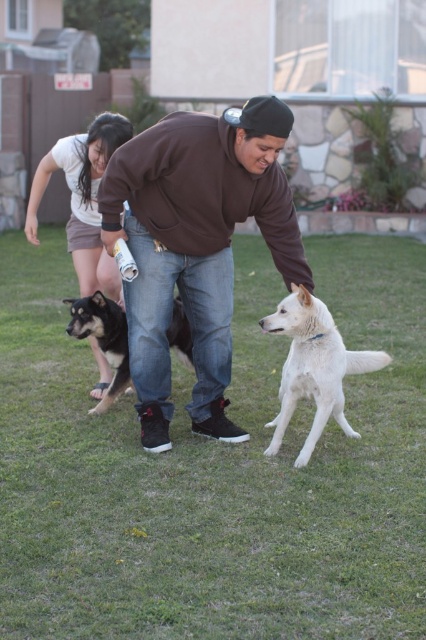
Is white fur dog at center thinner than white cotton shorts at lower left?

Correct, white fur dog at center's width is less than white cotton shorts at lower left's.

Consider the image. Is white fur dog at center taller than white cotton shorts at lower left?

Incorrect, white fur dog at center's height is not larger of white cotton shorts at lower left's.

Who is more distant from viewer, (336,330) or (117,122)?

Point (117,122)

I want to click on white fur dog at center, so click(x=313, y=368).

Consider the image. Does green grass at center have a larger size compared to brown cotton sweatshirt at center?

Yes.

Find the location of a particular element. Image resolution: width=426 pixels, height=640 pixels. green grass at center is located at coordinates (215, 470).

Who is positioned more to the left, green grass at center or white cotton shorts at lower left?

From the viewer's perspective, white cotton shorts at lower left appears more on the left side.

This screenshot has height=640, width=426. What do you see at coordinates (215, 470) in the screenshot?
I see `green grass at center` at bounding box center [215, 470].

The image size is (426, 640). I want to click on green grass at center, so click(x=215, y=470).